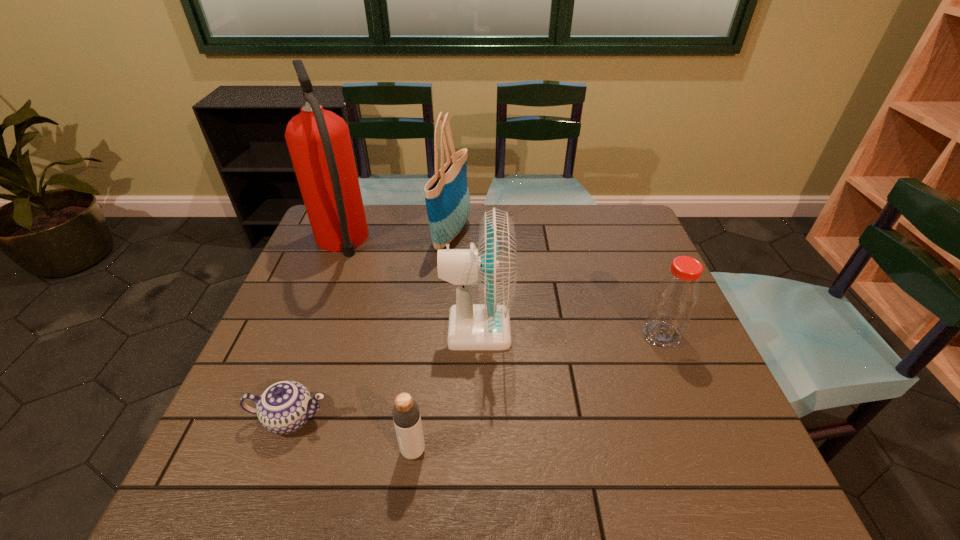
Where is `fire extinguisher`? The width and height of the screenshot is (960, 540). fire extinguisher is located at coordinates (319, 143).

Find the location of a particular element. The width and height of the screenshot is (960, 540). tote bag is located at coordinates pyautogui.click(x=447, y=197).

This screenshot has width=960, height=540. Identify the location of the fourth shortest object. click(493, 266).

The image size is (960, 540). Find the location of `the third shortest object`. the third shortest object is located at coordinates (676, 295).

Locate an element on the screen. the rightmost object is located at coordinates 676,295.

You are a GUI agent. You are given a task and a screenshot of the screen. Output one action in this format:
    pyautogui.click(x=<x>, y=<y>)
    Task: Click on the second shortest object
    This screenshot has height=540, width=960.
    Given the screenshot: What is the action you would take?
    pyautogui.click(x=406, y=416)

Where is `the left bottle`? the left bottle is located at coordinates (406, 416).

The width and height of the screenshot is (960, 540). In order to click on chinaware in this screenshot , I will do `click(284, 407)`.

Where is `free space located on the left of the tote bag`? This screenshot has height=540, width=960. free space located on the left of the tote bag is located at coordinates (415, 233).

The image size is (960, 540). I want to click on free space located in front of the fourth shortest object to face the airflow, so click(563, 329).